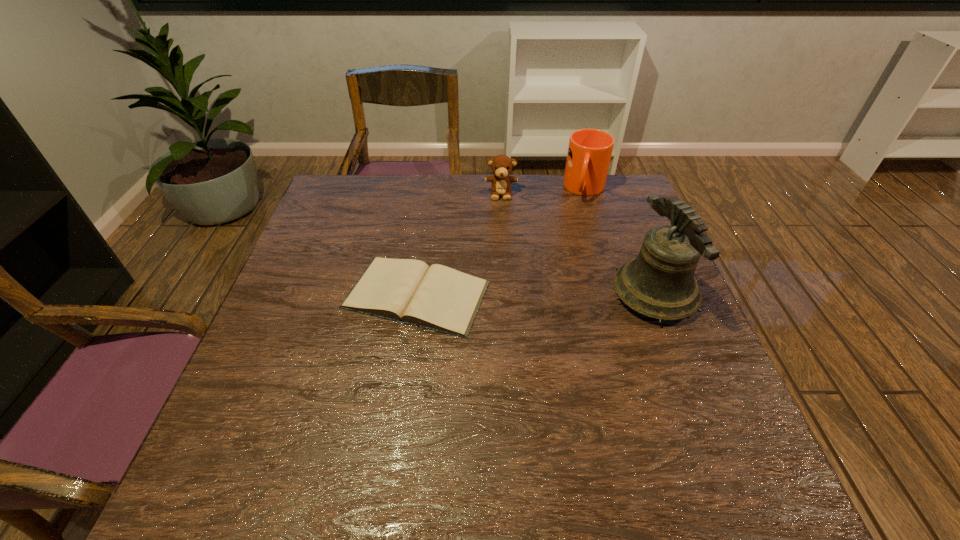
At what (x,y) coordinates should I click in order to perform the action: click on vacant space on the desktop that is between the Bible and the bell and is positioned on the face of the teddy bear. Please return your answer as a coordinate pair (x, y). Looking at the image, I should click on (500, 294).

I want to click on free space on the desktop that is between the Bible and the bell and is positioned on the handle side of the second tallest object, so click(567, 294).